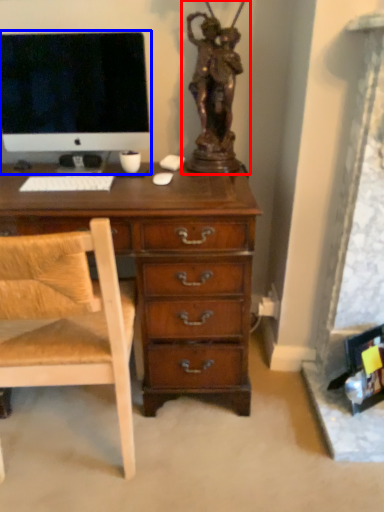
Question: Which object appears farthest to the camera in this image, sculpture (highlighted by a red box) or computer monitor (highlighted by a blue box)?

Choices:
 (A) sculpture
 (B) computer monitor

Answer: (B)